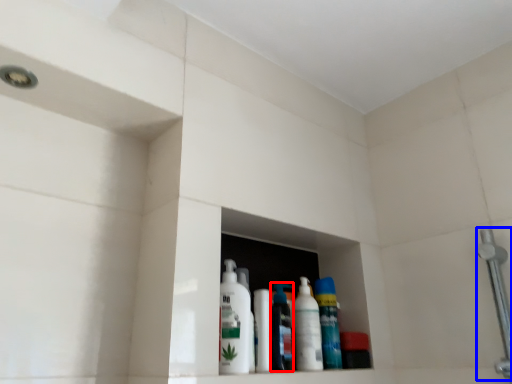
Question: Which object is further to the camera taking this photo, cleaning product (highlighted by a red box) or shower (highlighted by a blue box)?

Choices:
 (A) cleaning product
 (B) shower

Answer: (A)